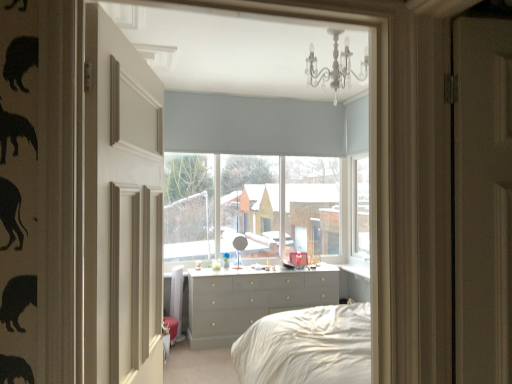
At what (x,y) coordinates should I click in order to perform the action: click on matte gray dresser at center. Please return your answer as a coordinate pair (x, y). Looking at the image, I should click on (277, 166).

What is the approximate height of matte gray roller blind at center?

1.97 meters.

The width and height of the screenshot is (512, 384). I want to click on matte white door at left, so click(x=121, y=207).

What do you see at coordinates (335, 67) in the screenshot?
I see `white crystal chandelier at upper center` at bounding box center [335, 67].

Image resolution: width=512 pixels, height=384 pixels. Find the location of `matte gray dresser at center`. matte gray dresser at center is located at coordinates (277, 166).

From a real-world perspective, which object stands above the other?

matte gray roller blind at center, from a real-world perspective.

Could you tell me if matte gray roller blind at center is facing matte white door at left?

Yes, matte gray roller blind at center is turned towards matte white door at left.

Can you tell me how much matte gray roller blind at center and matte white door at left differ in facing direction?

77.6 degrees separate the facing orientations of matte gray roller blind at center and matte white door at left.

Between matte gray roller blind at center and matte white door at left, which one has smaller size?

Smaller between the two is matte white door at left.

Is matte gray dresser at center positioned far away from matte white door at left?

That's right, there is a large distance between matte gray dresser at center and matte white door at left.

Considering the positions of objects matte gray dresser at center and matte white door at left in the image provided, who is behind, matte gray dresser at center or matte white door at left?

matte gray dresser at center is behind.

Which is more to the right, matte gray dresser at center or matte white door at left?

matte gray dresser at center is more to the right.

This screenshot has height=384, width=512. What are the coordinates of `door above the matte gray dresser at center (from the image's perspective)` in the screenshot? It's located at (121, 207).

Between light grey fabric blind at upper center and matte gray dresser at center, which one appears on the left side from the viewer's perspective?

light grey fabric blind at upper center is more to the left.

From a real-world perspective, between light grey fabric blind at upper center and matte gray dresser at center, who is vertically lower?

matte gray dresser at center is physically lower.

Does light grey fabric blind at upper center have a larger size compared to matte gray dresser at center?

Actually, light grey fabric blind at upper center might be smaller than matte gray dresser at center.

Is light grey fabric blind at upper center far away from matte gray dresser at center?

No, light grey fabric blind at upper center is in close proximity to matte gray dresser at center.

Is point (344, 79) positioned after point (202, 194)?

No, it is in front of (202, 194).

Consider the image. Is there a large distance between white crystal chandelier at upper center and matte gray roller blind at center?

Yes, white crystal chandelier at upper center and matte gray roller blind at center are located far from each other.

Does white crystal chandelier at upper center have a larger size compared to matte gray roller blind at center?

Actually, white crystal chandelier at upper center might be smaller than matte gray roller blind at center.

Measure the distance from white crystal chandelier at upper center to matte gray roller blind at center.

white crystal chandelier at upper center and matte gray roller blind at center are 6.90 feet apart.

Is matte gray dresser at center surrounding white crystal chandelier at upper center?

That's incorrect, white crystal chandelier at upper center is not inside matte gray dresser at center.

Locate an element on the screen. The height and width of the screenshot is (384, 512). light fixture that is in front of the matte gray dresser at center is located at coordinates (335, 67).

From a real-world perspective, which is physically below, matte gray dresser at center or white crystal chandelier at upper center?

matte gray dresser at center is physically lower.

Between matte gray dresser at center and white crystal chandelier at upper center, which one has larger width?

Wider between the two is matte gray dresser at center.

Is white crystal chandelier at upper center inside or outside of matte gray dresser at center?

white crystal chandelier at upper center is located beyond the bounds of matte gray dresser at center.

Does white crystal chandelier at upper center come in front of matte gray dresser at center?

Yes.

Locate an element on the screen. The image size is (512, 384). light fixture above the matte gray dresser at center (from the image's perspective) is located at coordinates (335, 67).

Which object is positioned more to the right, white crystal chandelier at upper center or matte gray dresser at center?

Positioned to the right is white crystal chandelier at upper center.

Which object is positioned more to the right, matte gray roller blind at center or light grey fabric blind at upper center?

Positioned to the right is matte gray roller blind at center.

Consider the image. Could you tell me if matte gray roller blind at center is facing light grey fabric blind at upper center?

Yes, matte gray roller blind at center is aimed at light grey fabric blind at upper center.

Between matte gray roller blind at center and light grey fabric blind at upper center, which one has smaller size?

light grey fabric blind at upper center is smaller.

Which of these two, matte gray roller blind at center or light grey fabric blind at upper center, is wider?

matte gray roller blind at center.

This screenshot has width=512, height=384. I want to click on window above the matte white door at left (from a real-world perspective), so click(x=262, y=207).

Where is `chest of drawers below the matte white door at left (from the image's perspective)`? chest of drawers below the matte white door at left (from the image's perspective) is located at coordinates (251, 300).

From the image, which object appears to be nearer to matte white door at left, matte gray dresser at center or white crystal chandelier at upper center?

white crystal chandelier at upper center.

Looking at the image, which one is located closer to white crystal chandelier at upper center, matte white door at left or light grey fabric blind at upper center?

light grey fabric blind at upper center is positioned closer to the anchor white crystal chandelier at upper center.

Based on their spatial positions, is light grey fabric blind at upper center or white crystal chandelier at upper center closer to matte gray dresser at center?

light grey fabric blind at upper center.

From the image, which object appears to be farther from matte white door at left, white crystal chandelier at upper center or matte gray dresser at center?

matte gray dresser at center.

Looking at the image, which one is located closer to matte gray dresser at center, matte white door at left or light grey fabric blind at upper center?

light grey fabric blind at upper center is closer to matte gray dresser at center.

When comparing their distances from matte gray dresser at center, does white crystal chandelier at upper center or matte white door at left seem closer?

white crystal chandelier at upper center is positioned closer to the anchor matte gray dresser at center.

When comparing their distances from light grey fabric blind at upper center, does matte white door at left or matte gray roller blind at center seem further?

matte white door at left lies further to light grey fabric blind at upper center than the other object.

From the image, which object appears to be nearer to matte gray dresser at center, matte gray roller blind at center or matte gray dresser at center?

matte gray roller blind at center.

Image resolution: width=512 pixels, height=384 pixels. Find the location of `blind between white crystal chandelier at upper center and matte gray roller blind at center from front to back`. blind between white crystal chandelier at upper center and matte gray roller blind at center from front to back is located at coordinates [x=252, y=125].

I want to click on the chest of drawers located between matte white door at left and light grey fabric blind at upper center in the depth direction, so click(251, 300).

In order to click on light fixture between matte white door at left and matte gray dresser at center in the front-back direction in this screenshot , I will do `click(335, 67)`.

This screenshot has width=512, height=384. Find the location of `light fixture positioned between matte gray dresser at center and matte gray roller blind at center from near to far`. light fixture positioned between matte gray dresser at center and matte gray roller blind at center from near to far is located at coordinates tap(335, 67).